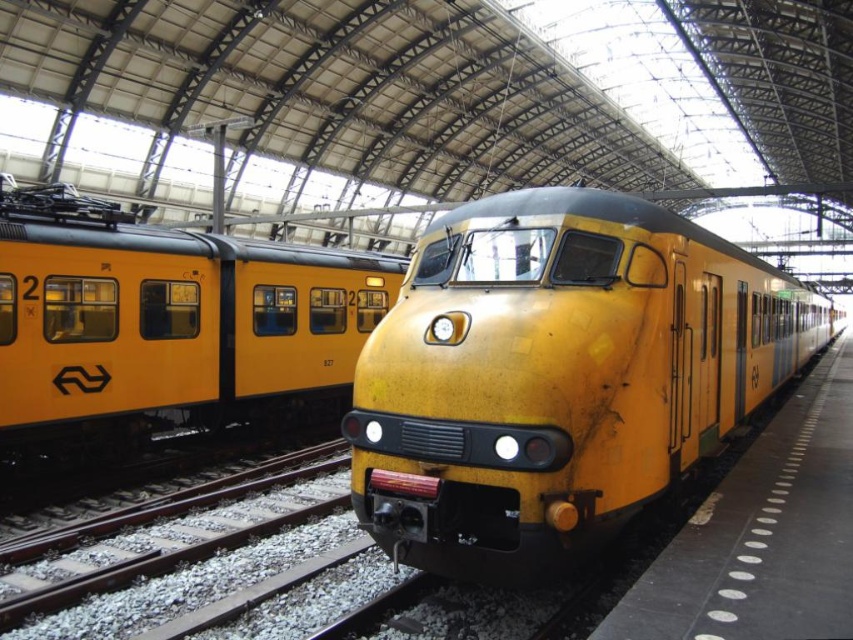
Is yellow matte train at center smaller than matte yellow train at center?

Yes, yellow matte train at center is smaller than matte yellow train at center.

Which is more to the left, yellow matte train at center or matte yellow train at center?

Positioned to the left is matte yellow train at center.

Image resolution: width=853 pixels, height=640 pixels. Describe the element at coordinates (558, 376) in the screenshot. I see `yellow matte train at center` at that location.

Find the location of a particular element. yellow matte train at center is located at coordinates (558, 376).